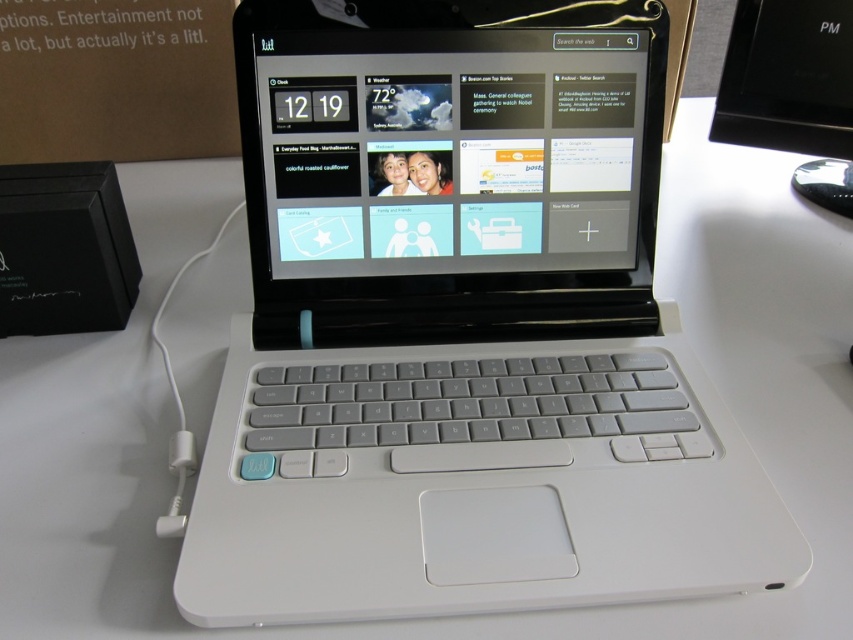
Question: Does white matte laptop at center come behind matte black screen at center?

Choices:
 (A) no
 (B) yes

Answer: (A)

Question: Which object appears farthest from the camera in this image?

Choices:
 (A) white matte mouse at center
 (B) white matte laptop at center

Answer: (A)

Question: Does white matte laptop at center appear on the left side of matte black screen at center?

Choices:
 (A) yes
 (B) no

Answer: (B)

Question: Estimate the real-world distances between objects in this image. Which object is closer to the matte black screen at center?

Choices:
 (A) white matte laptop at center
 (B) white matte mouse at center

Answer: (A)

Question: Is matte black screen at center to the left of white matte mouse at center from the viewer's perspective?

Choices:
 (A) yes
 (B) no

Answer: (A)

Question: Which object is positioned closest to the white matte mouse at center?

Choices:
 (A) white matte laptop at center
 (B) matte black screen at center

Answer: (A)